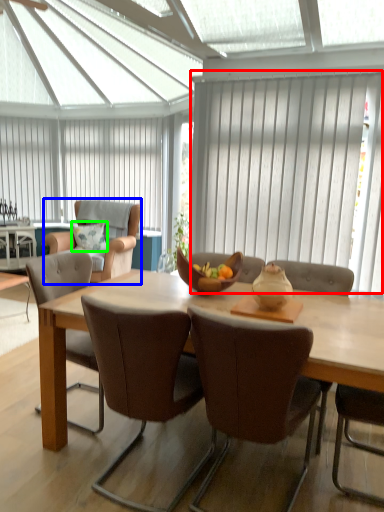
Question: Which object is positioned farthest from curtain (highlighted by a red box)? Select from chair (highlighted by a blue box) and pillow (highlighted by a green box).

Choices:
 (A) chair
 (B) pillow

Answer: (B)